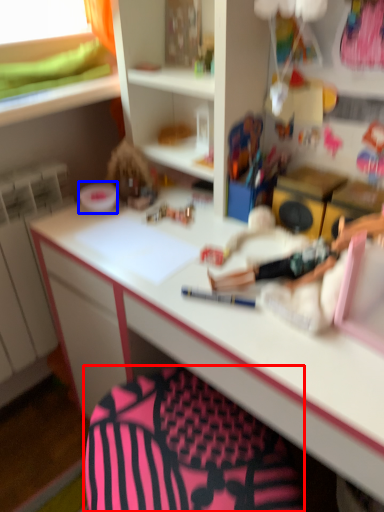
Question: Which of the following is the farthest to the observer, swivel chair (highlighted by a red box) or stationery (highlighted by a blue box)?

Choices:
 (A) swivel chair
 (B) stationery

Answer: (B)